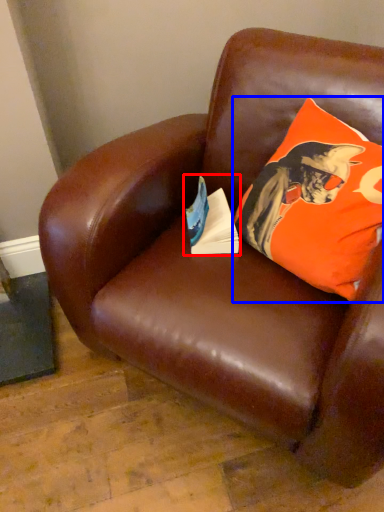
Question: Which object is further to the camera taking this photo, paperback book (highlighted by a red box) or pillow (highlighted by a blue box)?

Choices:
 (A) paperback book
 (B) pillow

Answer: (A)